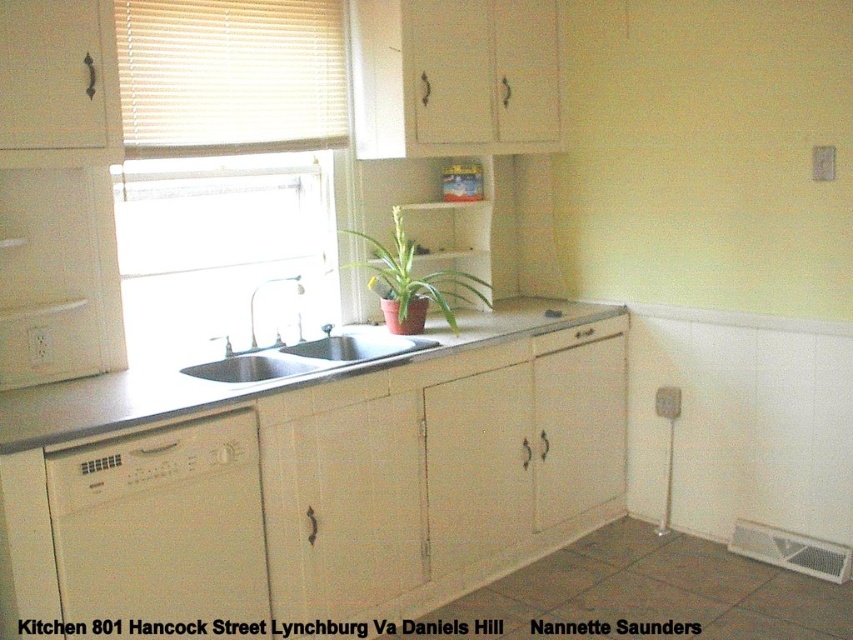
Question: Which object is closer to the camera taking this photo?

Choices:
 (A) matte clay pot at center
 (B) black stainless steel sink at center

Answer: (B)

Question: Among these objects, which one is nearest to the camera?

Choices:
 (A) white blinds at upper center
 (B) white matte dishwasher at lower left
 (C) black stainless steel sink at center

Answer: (B)

Question: Does white matte dishwasher at lower left lie in front of black stainless steel sink at center?

Choices:
 (A) no
 (B) yes

Answer: (B)

Question: Which point is farther to the camera?

Choices:
 (A) smooth granite countertop at center
 (B) white blinds at upper center
 (C) black stainless steel sink at center
 (D) white matte dishwasher at lower left

Answer: (B)

Question: Where is white blinds at upper center located in relation to matte clay pot at center in the image?

Choices:
 (A) below
 (B) above

Answer: (B)

Question: Does white matte dishwasher at lower left come in front of white matte drawer at center?

Choices:
 (A) no
 (B) yes

Answer: (B)